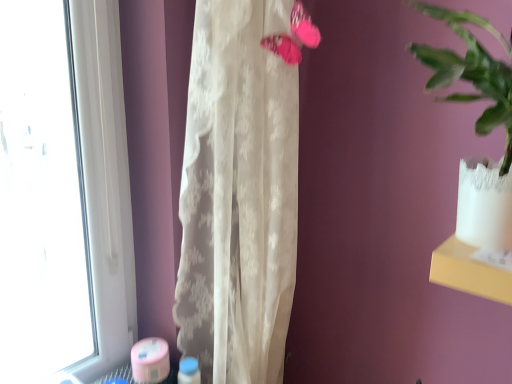
Question: Should I look upward or downward to see pink fabric butterfly at upper center?

Choices:
 (A) down
 (B) up

Answer: (B)

Question: Would you say translucent white curtain at center contains pink fabric butterfly at upper center?

Choices:
 (A) no
 (B) yes

Answer: (B)

Question: From the image's perspective, would you say translucent white curtain at center is shown under pink fabric butterfly at upper center?

Choices:
 (A) no
 (B) yes

Answer: (B)

Question: Does translucent white curtain at center have a lesser height compared to pink fabric butterfly at upper center?

Choices:
 (A) yes
 (B) no

Answer: (B)

Question: Is translucent white curtain at center at the left side of pink fabric butterfly at upper center?

Choices:
 (A) no
 (B) yes

Answer: (B)

Question: Could you tell me if translucent white curtain at center is facing pink fabric butterfly at upper center?

Choices:
 (A) no
 (B) yes

Answer: (B)

Question: Is the depth of translucent white curtain at center greater than that of pink fabric butterfly at upper center?

Choices:
 (A) no
 (B) yes

Answer: (A)

Question: From a real-world perspective, does pink fabric butterfly at upper center stand above translucent white curtain at center?

Choices:
 (A) no
 (B) yes

Answer: (B)

Question: Considering the relative sizes of pink fabric butterfly at upper center and translucent white curtain at center in the image provided, is pink fabric butterfly at upper center taller than translucent white curtain at center?

Choices:
 (A) yes
 (B) no

Answer: (B)

Question: Considering the relative positions of pink fabric butterfly at upper center and translucent white curtain at center in the image provided, is pink fabric butterfly at upper center behind translucent white curtain at center?

Choices:
 (A) no
 (B) yes

Answer: (B)

Question: Is pink fabric butterfly at upper center to the right of translucent white curtain at center from the viewer's perspective?

Choices:
 (A) yes
 (B) no

Answer: (A)

Question: Is pink fabric butterfly at upper center turned away from translucent white curtain at center?

Choices:
 (A) yes
 (B) no

Answer: (A)

Question: From the image's perspective, does pink fabric butterfly at upper center appear higher than translucent white curtain at center?

Choices:
 (A) no
 (B) yes

Answer: (B)

Question: Would you say pink fabric butterfly at upper center is to the left or to the right of translucent white curtain at center in the picture?

Choices:
 (A) right
 (B) left

Answer: (A)